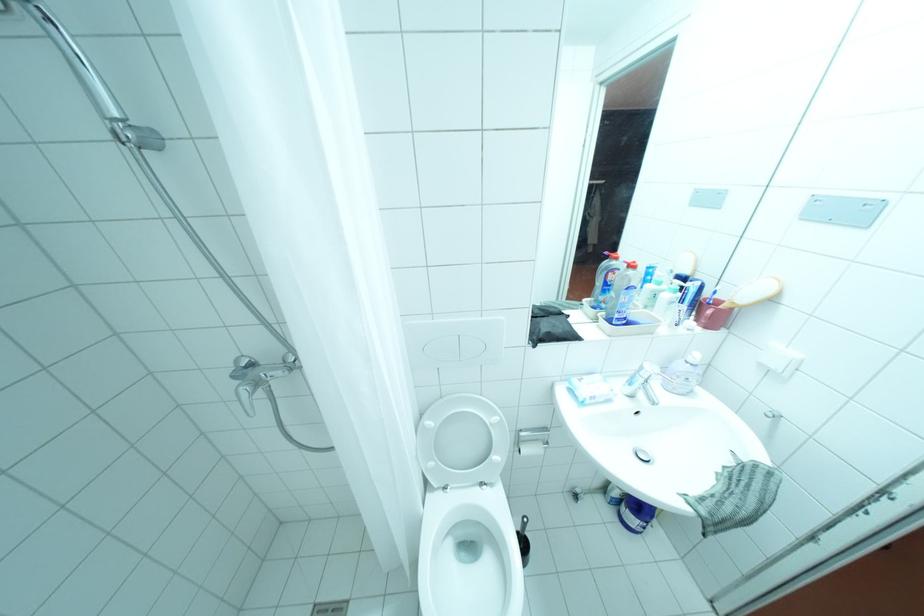
The location [623,294] corresponds to which object?

This point indicates the blue cleaning bottle.